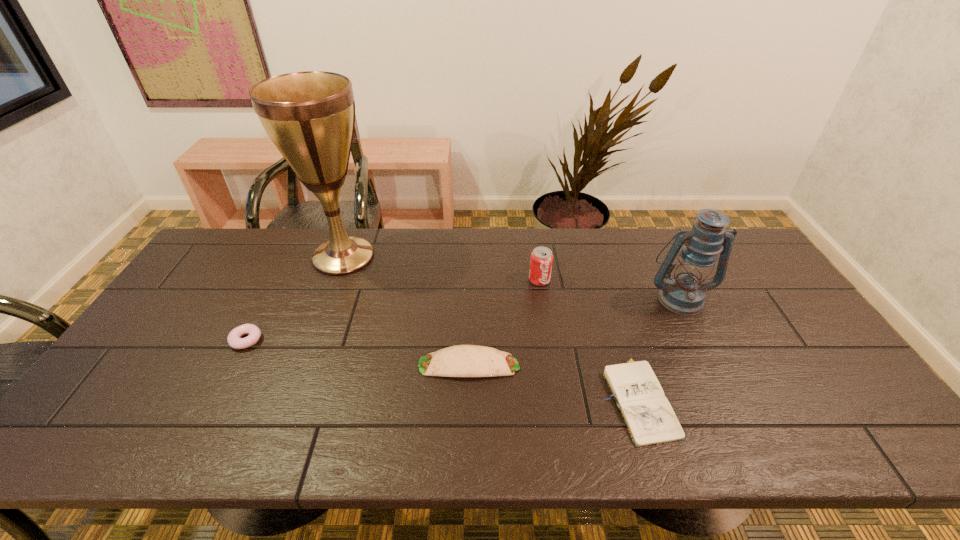
Identify the location of free space located 0.220m on the left of the tallest object. Image resolution: width=960 pixels, height=540 pixels. (240, 256).

Locate an element on the screen. vacant space located on the front-facing side of the rightmost object is located at coordinates (x=728, y=396).

Identify the location of blank area located 0.100m on the left of the fourth shortest object. (497, 280).

Identify the location of vacant space situated at the bitten end of the fourth object from right to left. This screenshot has width=960, height=540. (605, 365).

The height and width of the screenshot is (540, 960). Find the location of `free space located 0.360m on the back of the doughnut`. free space located 0.360m on the back of the doughnut is located at coordinates (293, 251).

The height and width of the screenshot is (540, 960). Find the location of `free location located 0.380m on the left of the fifth object from left to right`. free location located 0.380m on the left of the fifth object from left to right is located at coordinates (446, 398).

Identify the location of object located at the far edge. (310, 116).

Identify the location of object present at the near edge. This screenshot has width=960, height=540. (647, 413).

Identify the location of vacant area at the far edge. This screenshot has width=960, height=540. 565,240.

In order to click on free location at the near edge of the desktop in this screenshot , I will do `click(731, 422)`.